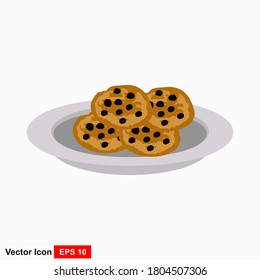
The image size is (260, 280). In order to click on bowl in this screenshot , I will do `click(122, 153)`.